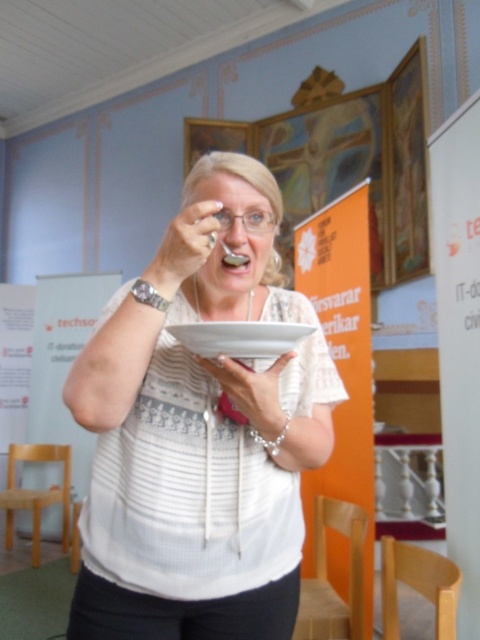
Between white matte bowl at center and white matte spoon at upper center, which one has more height?

white matte bowl at center

Based on the photo, between white matte bowl at center and white matte spoon at upper center, which one has less height?

Standing shorter between the two is white matte spoon at upper center.

Does point (188, 356) come closer to viewer compared to point (199, 208)?

No.

Where is `white matte bowl at center`? white matte bowl at center is located at coordinates (201, 440).

Which is in front, point (278, 349) or point (204, 227)?

Point (204, 227) is in front.

Who is positioned more to the right, white glossy plate at center or white matte spoon at upper center?

Positioned to the right is white glossy plate at center.

Measure the distance between point (278,344) and camera.

Point (278,344) and camera are 32.02 inches apart from each other.

You are a GUI agent. You are given a task and a screenshot of the screen. Output one action in this format:
    pyautogui.click(x=<x>, y=<y>)
    Task: Click on the white glossy plate at center
    
    Given the screenshot: What is the action you would take?
    pyautogui.click(x=240, y=337)

Is white matte bowl at center wider than white matte hand at center?

Indeed, white matte bowl at center has a greater width compared to white matte hand at center.

The width and height of the screenshot is (480, 640). I want to click on white matte bowl at center, so click(x=201, y=440).

You are a GUI agent. You are given a task and a screenshot of the screen. Output one action in this format:
    pyautogui.click(x=<x>, y=<y>)
    Task: Click on the white matte bowl at center
    The image size is (480, 640).
    Given the screenshot: What is the action you would take?
    pyautogui.click(x=201, y=440)